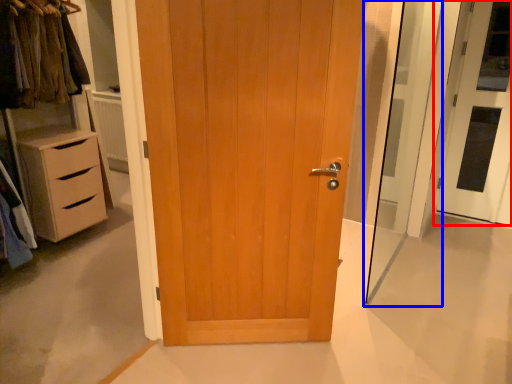
Question: Which of the following is the farthest to the observer, door (highlighted by a red box) or screen door (highlighted by a blue box)?

Choices:
 (A) door
 (B) screen door

Answer: (A)